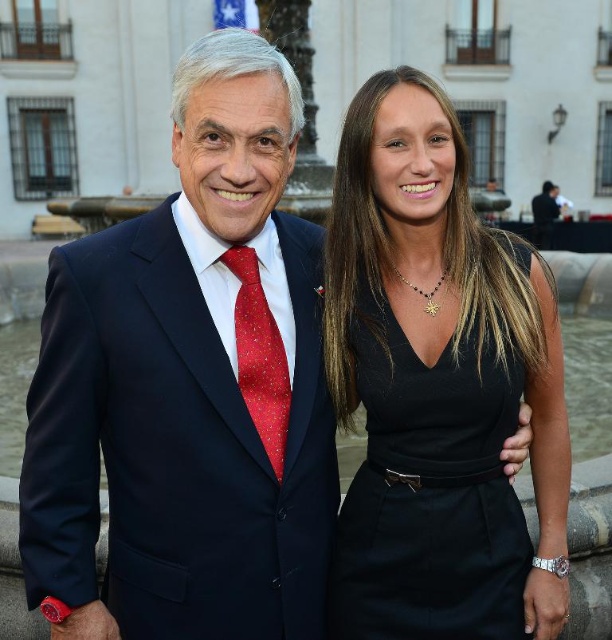
Question: Which point is farther from the camera taking this photo?

Choices:
 (A) (382, 456)
 (B) (241, 349)
 (C) (121, 308)

Answer: (A)

Question: Considering the real-world distances, which object is closest to the black satin dress at center?

Choices:
 (A) red dotted fabric tie at left
 (B) navy blue suit at left

Answer: (A)

Question: Is black satin dress at center thinner than red dotted fabric tie at left?

Choices:
 (A) no
 (B) yes

Answer: (B)

Question: Which point appears closest to the camera in this image?

Choices:
 (A) (510, 406)
 (B) (143, 589)

Answer: (B)

Question: Can you confirm if black satin dress at center is positioned to the left of red dotted fabric tie at left?

Choices:
 (A) no
 (B) yes

Answer: (A)

Question: Can you confirm if navy blue suit at left is thinner than red dotted fabric tie at left?

Choices:
 (A) no
 (B) yes

Answer: (A)